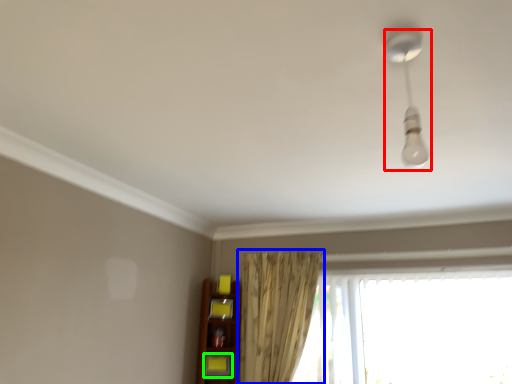
Question: Considering the real-world distances, which object is closest to lamp (highlighted by a red box)? curtain (highlighted by a blue box) or shelf (highlighted by a green box).

Choices:
 (A) curtain
 (B) shelf

Answer: (A)